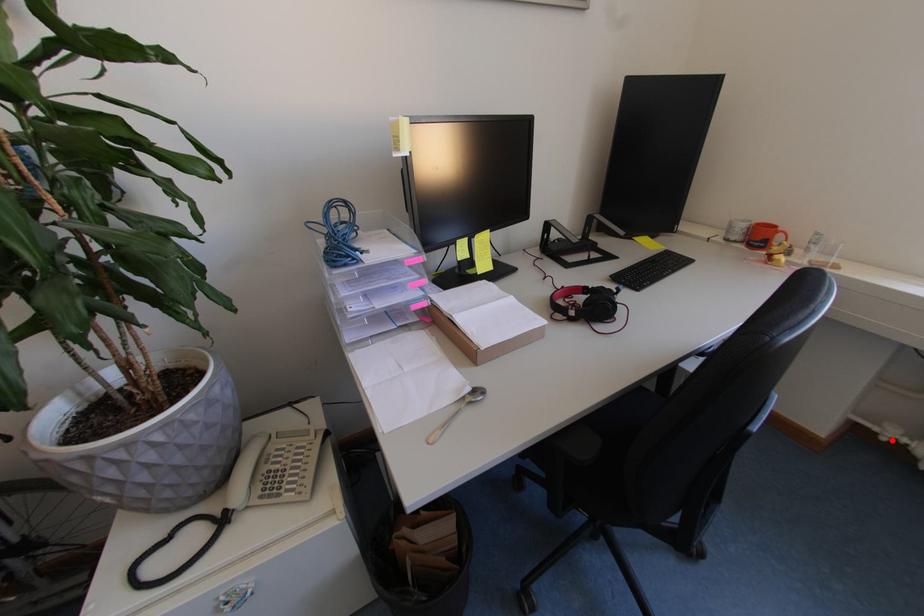
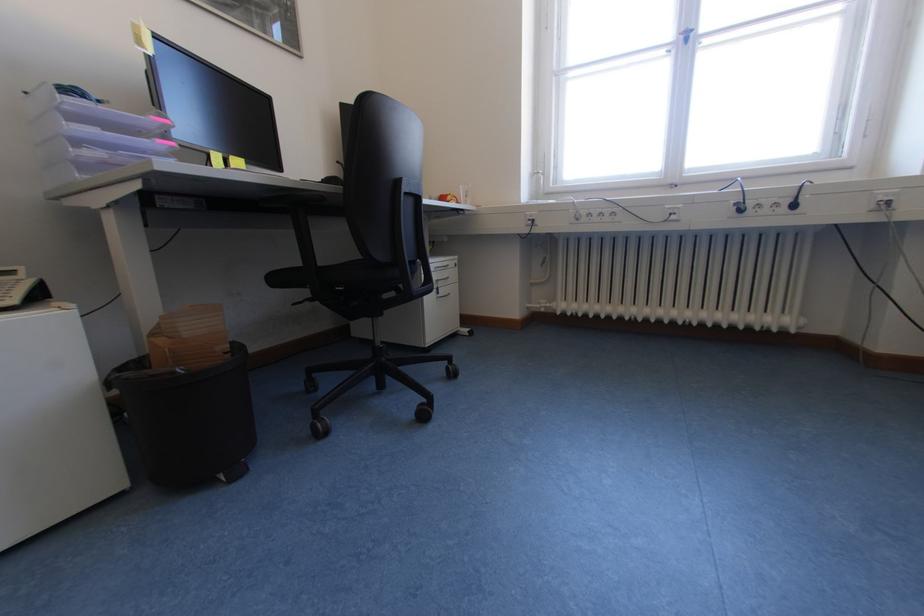
Find the pixel in the second image that matches the highlighted location in the first image.

(551, 310)